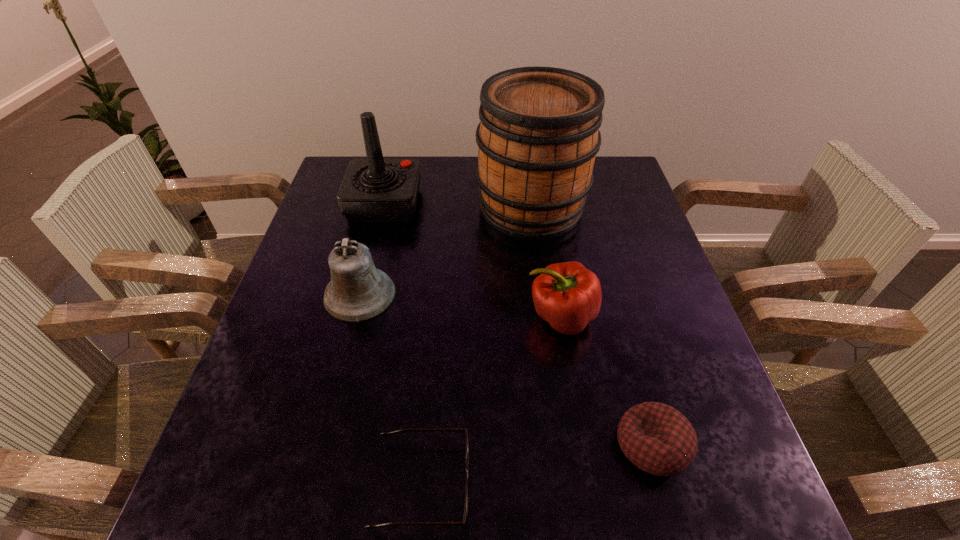
Image resolution: width=960 pixels, height=540 pixels. In order to click on the tallest object in this screenshot , I will do `click(538, 136)`.

Locate an element on the screen. This screenshot has height=540, width=960. joystick is located at coordinates (375, 190).

Locate an element on the screen. The image size is (960, 540). bell is located at coordinates 358,291.

Locate an element on the screen. The width and height of the screenshot is (960, 540). bell pepper is located at coordinates (568, 296).

Locate an element on the screen. This screenshot has width=960, height=540. beanbag is located at coordinates (657, 438).

You are a GUI agent. You are given a task and a screenshot of the screen. Output one action in this format:
    pyautogui.click(x=<x>, y=<y>)
    Task: Click on the third object from left to right
    
    Given the screenshot: What is the action you would take?
    pyautogui.click(x=384, y=434)

At what (x,y) coordinates should I click in order to perform the action: click on sunglasses. Please return your answer as a coordinate pair (x, y). Looking at the image, I should click on (384, 434).

This screenshot has height=540, width=960. What are the coordinates of `vacant space located on the left of the tallest object` in the screenshot? It's located at (427, 208).

What are the coordinates of `free point located on the front-facing side of the joystick` in the screenshot? It's located at (546, 204).

The height and width of the screenshot is (540, 960). I want to click on vacant space situated 0.240m on the front of the bell, so click(326, 425).